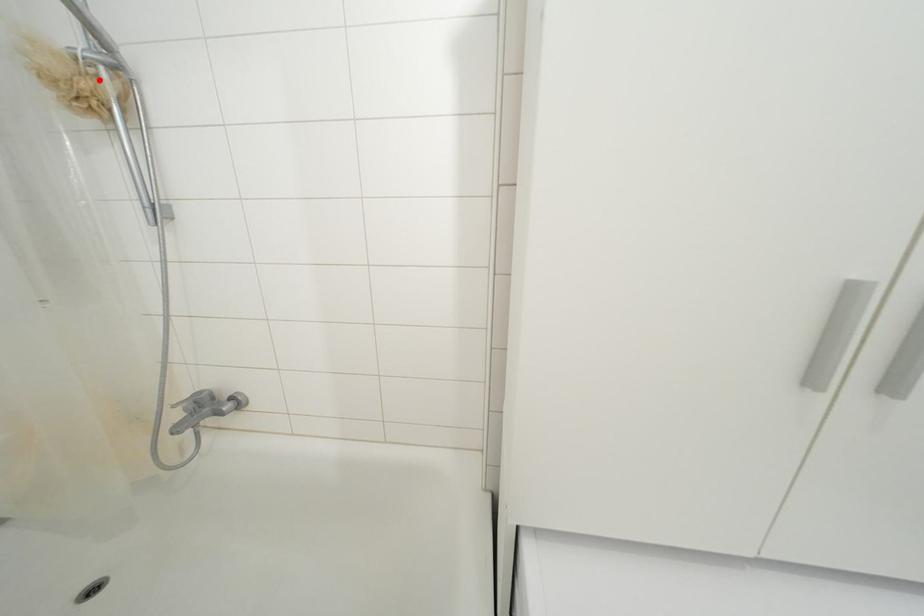
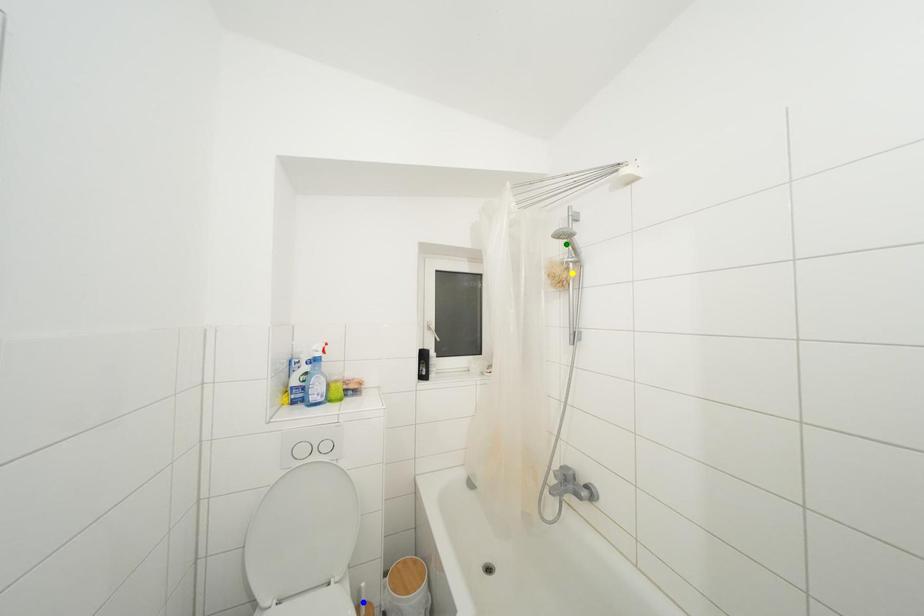
Question: I am providing you with two images of the same scene from different viewpoints. A red point is marked on the first image. You are given multiple points on the second image. In image 2, which mark is for the same physical point as the one in image 1?

Choices:
 (A) yellow point
 (B) green point
 (C) blue point

Answer: (A)